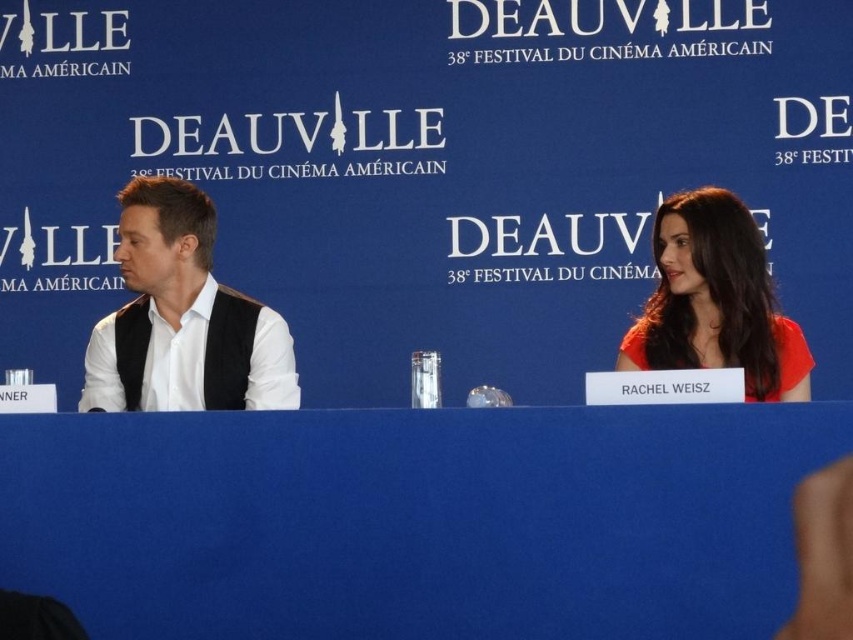
Question: Which point is farther from the camera taking this photo?

Choices:
 (A) (132, 284)
 (B) (393, 621)
 (C) (672, 349)

Answer: (A)

Question: Which object appears farthest from the camera in this image?

Choices:
 (A) white matte vest at left
 (B) matte red dress at right
 (C) blue fabric table at center

Answer: (A)

Question: Does blue fabric table at center appear on the left side of white matte vest at left?

Choices:
 (A) yes
 (B) no

Answer: (B)

Question: Does white matte vest at left lie in front of matte red dress at right?

Choices:
 (A) yes
 (B) no

Answer: (B)

Question: Is white matte vest at left further to camera compared to matte red dress at right?

Choices:
 (A) yes
 (B) no

Answer: (A)

Question: Which object is positioned closest to the blue fabric table at center?

Choices:
 (A) white matte vest at left
 (B) matte red dress at right

Answer: (A)